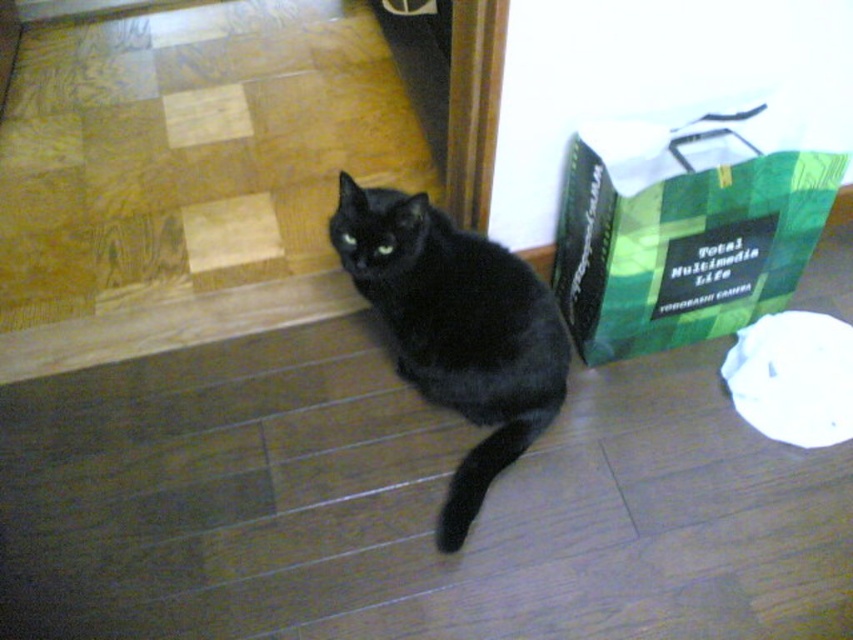
Based on the photo, you are a photographer trying to capture the black fur cat at center. You notice the green paper shopping bag at right is blocking your view. Can you move the bag to the left to get a clear shot of the cat?

The green paper shopping bag at right is positioned over black fur cat at center, so moving it to the left would allow you to see the cat clearly.

You are a photographer setting up a shoot. You have a green paper shopping bag at right and a black fur cat at center in your frame. The cat is sitting on a wooden floor. You want to place a small toy next to the object that is smaller in size. Which object should you place it next to?

The green paper shopping bag at right has a smaller size compared to the black fur cat at center, so you should place the small toy next to the green paper shopping bag at right.

You are a photographer trying to capture a photo of the black fur cat at center. The green paper shopping bag at right is blocking your view slightly. Can you estimate if the bag is shorter than the cat so you can decide whether to move closer or adjust your angle?

The green paper shopping bag at right is not as tall as black fur cat at center, so the bag is shorter. You can adjust your angle slightly to avoid the bag without moving closer.